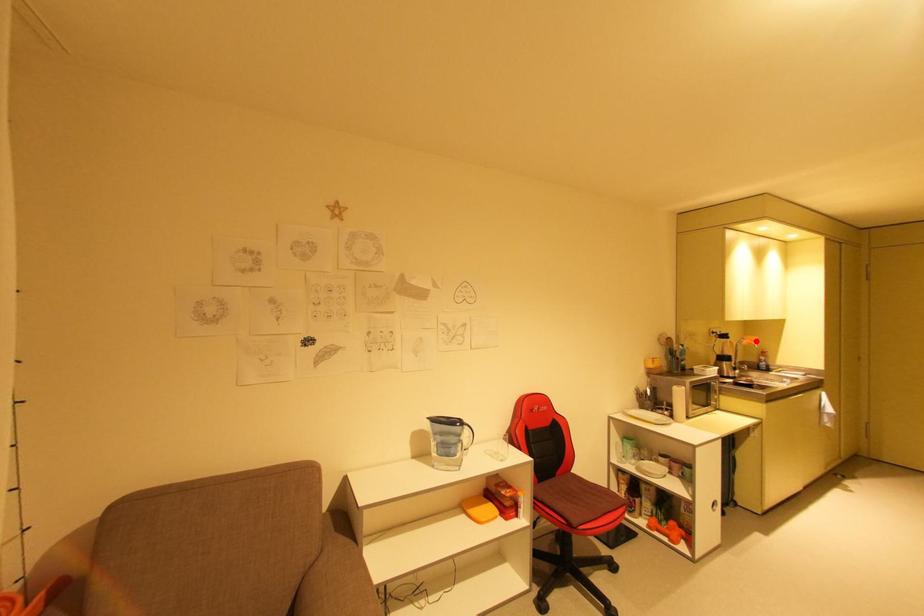
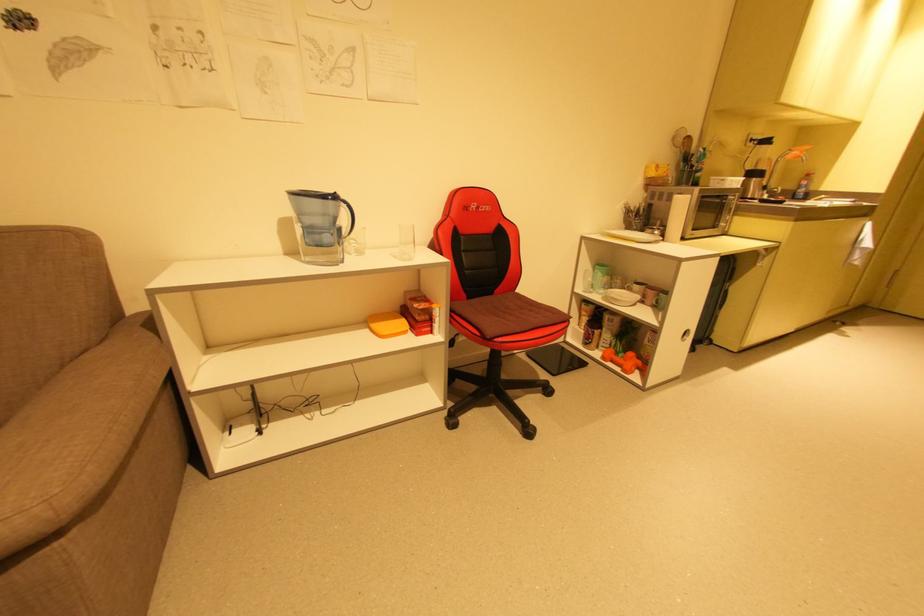
The point at the highlighted location is marked in the first image. Where is the corresponding point in the second image?

(805, 152)